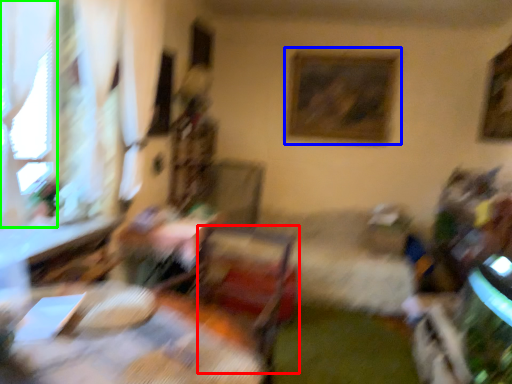
Question: Based on their relative distances, which object is farther from swivel chair (highlighted by a red box)? Choose from picture frame (highlighted by a blue box) and window (highlighted by a green box).

Choices:
 (A) picture frame
 (B) window

Answer: (A)